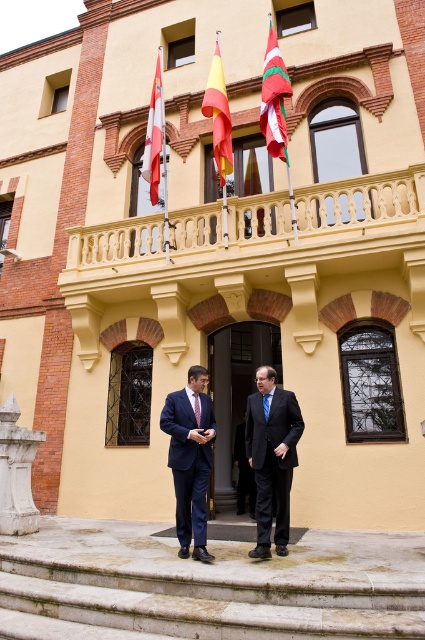
Is blue suit at center positioned in front of dark blue suit at center?

Yes, it is in front of dark blue suit at center.

Who is positioned more to the right, blue suit at center or dark blue suit at center?

dark blue suit at center

The height and width of the screenshot is (640, 425). I want to click on blue suit at center, so click(187, 451).

Can you confirm if white stone pillar at lower left is bigger than white and red striped flag at upper center?

Incorrect, white stone pillar at lower left is not larger than white and red striped flag at upper center.

What do you see at coordinates (17, 472) in the screenshot?
I see `white stone pillar at lower left` at bounding box center [17, 472].

I want to click on white stone pillar at lower left, so click(x=17, y=472).

Which of these two, dark blue suit at center or polished silver flag at upper left, stands shorter?

dark blue suit at center

Looking at this image, can you confirm if dark blue suit at center is smaller than polished silver flag at upper left?

Indeed, dark blue suit at center has a smaller size compared to polished silver flag at upper left.

Find the location of `dark blue suit at center`. dark blue suit at center is located at coordinates (272, 460).